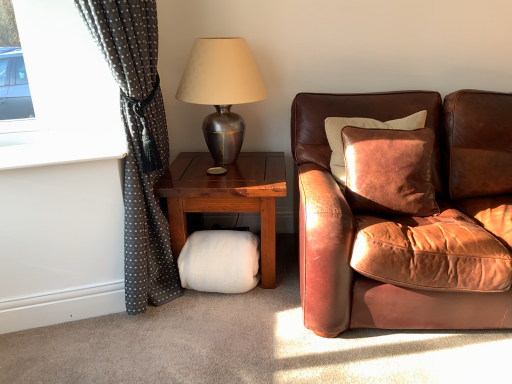
Image resolution: width=512 pixels, height=384 pixels. What do you see at coordinates (138, 144) in the screenshot?
I see `dark grey polka dot fabric at left` at bounding box center [138, 144].

Locate an element on the screen. The width and height of the screenshot is (512, 384). brown leather couch at right is located at coordinates (409, 220).

Locate an element on the screen. This screenshot has width=512, height=384. leather cushion at right is located at coordinates (389, 171).

Where is `white fluffy footrest at lower center`? Image resolution: width=512 pixels, height=384 pixels. white fluffy footrest at lower center is located at coordinates (220, 261).

Is white fluffy pillow at lower center in front of metallic silver lamp at upper center?

No, it is behind metallic silver lamp at upper center.

Consider the image. What's the angular difference between white fluffy pillow at lower center and metallic silver lamp at upper center's facing directions?

There is a 0.00063-degree angle between the facing directions of white fluffy pillow at lower center and metallic silver lamp at upper center.

From the image's perspective, which is below, white fluffy pillow at lower center or metallic silver lamp at upper center?

white fluffy pillow at lower center is shown below in the image.

Is metallic silver lamp at upper center with white fluffy pillow at lower center?

No, metallic silver lamp at upper center is not beside white fluffy pillow at lower center.

Which object is positioned more to the right, metallic silver lamp at upper center or white fluffy pillow at lower center?

white fluffy pillow at lower center.

Considering the positions of objects metallic silver lamp at upper center and white fluffy pillow at lower center in the image provided, who is in front, metallic silver lamp at upper center or white fluffy pillow at lower center?

Positioned in front is metallic silver lamp at upper center.

Which object is closer to the camera taking this photo, white fluffy pillow at lower center or white fluffy footrest at lower center?

white fluffy pillow at lower center is more forward.

Could you tell me if white fluffy pillow at lower center is turned towards white fluffy footrest at lower center?

Yes, white fluffy pillow at lower center is facing white fluffy footrest at lower center.

Is point (265, 186) closer to viewer compared to point (244, 282)?

Yes, it is.

Does white fluffy pillow at lower center have a larger size compared to white fluffy footrest at lower center?

Yes, white fluffy pillow at lower center is bigger than white fluffy footrest at lower center.

From the image's perspective, between leather cushion at right and white fluffy pillow at lower center, who is located below?

white fluffy pillow at lower center appears lower in the image.

Looking at their sizes, would you say leather cushion at right is wider or thinner than white fluffy pillow at lower center?

Clearly, leather cushion at right has less width compared to white fluffy pillow at lower center.

Is leather cushion at right in front of or behind white fluffy pillow at lower center in the image?

leather cushion at right is positioned closer to the viewer than white fluffy pillow at lower center.

Could you tell me if leather cushion at right is turned towards white fluffy pillow at lower center?

No, leather cushion at right is not oriented towards white fluffy pillow at lower center.

Is white fluffy footrest at lower center not inside dark grey polka dot fabric at left?

Yes.

From the image's perspective, which one is positioned lower, white fluffy footrest at lower center or dark grey polka dot fabric at left?

From the image's view, white fluffy footrest at lower center is below.

Looking at their sizes, would you say white fluffy footrest at lower center is wider or thinner than dark grey polka dot fabric at left?

Clearly, white fluffy footrest at lower center has less width compared to dark grey polka dot fabric at left.

Looking at this image, who is more distant, dark grey polka dot fabric at left or leather cushion at right?

leather cushion at right.

Is point (149, 138) closer or farther from the camera than point (395, 182)?

Clearly, point (149, 138) is more distant from the camera than point (395, 182).

From the image's perspective, is dark grey polka dot fabric at left above leather cushion at right?

Yes.

From a real-world perspective, who is located lower, dark grey polka dot fabric at left or leather cushion at right?

leather cushion at right.

Which object is positioned more to the right, white fluffy footrest at lower center or metallic silver lamp at upper center?

From the viewer's perspective, metallic silver lamp at upper center appears more on the right side.

Is white fluffy footrest at lower center in contact with metallic silver lamp at upper center?

white fluffy footrest at lower center is not next to metallic silver lamp at upper center, and they're not touching.

From a real-world perspective, which is physically below, white fluffy footrest at lower center or metallic silver lamp at upper center?

white fluffy footrest at lower center is physically lower.

How many degrees apart are the facing directions of white fluffy footrest at lower center and metallic silver lamp at upper center?

The facing directions of white fluffy footrest at lower center and metallic silver lamp at upper center are 0.672 degrees apart.

In the image, there is a metallic silver lamp at upper center. Identify the location of studio couch below it (from a real-world perspective). (226, 196).

I want to click on studio couch lying on the right of metallic silver lamp at upper center, so click(x=226, y=196).

When comparing their distances from white fluffy footrest at lower center, does metallic silver lamp at upper center or leather cushion at right seem closer?

Among the two, metallic silver lamp at upper center is located nearer to white fluffy footrest at lower center.

When comparing their distances from metallic silver lamp at upper center, does white fluffy pillow at lower center or brown leather couch at right seem closer?

white fluffy pillow at lower center is closer to metallic silver lamp at upper center.

Based on their spatial positions, is dark grey polka dot fabric at left or leather cushion at right closer to metallic silver lamp at upper center?

dark grey polka dot fabric at left lies closer to metallic silver lamp at upper center than the other object.

Which object lies nearer to the anchor point metallic silver lamp at upper center, leather cushion at right or white fluffy footrest at lower center?

Among the two, white fluffy footrest at lower center is located nearer to metallic silver lamp at upper center.

Which object lies nearer to the anchor point metallic silver lamp at upper center, dark grey polka dot fabric at left or white fluffy footrest at lower center?

Based on the image, dark grey polka dot fabric at left appears to be nearer to metallic silver lamp at upper center.

When comparing their distances from brown leather couch at right, does metallic silver lamp at upper center or leather cushion at right seem further?

metallic silver lamp at upper center is positioned further to the anchor brown leather couch at right.

Which object lies nearer to the anchor point brown leather couch at right, dark grey polka dot fabric at left or white fluffy footrest at lower center?

white fluffy footrest at lower center lies closer to brown leather couch at right than the other object.

Estimate the real-world distances between objects in this image. Which object is closer to dark grey polka dot fabric at left, brown leather couch at right or metallic silver lamp at upper center?

metallic silver lamp at upper center is positioned closer to the anchor dark grey polka dot fabric at left.

This screenshot has width=512, height=384. In order to click on lamp located between dark grey polka dot fabric at left and brown leather couch at right in the left-right direction in this screenshot , I will do `click(221, 91)`.

I want to click on studio couch situated between white fluffy footrest at lower center and brown leather couch at right from left to right, so click(226, 196).

Identify the location of studio couch between dark grey polka dot fabric at left and brown leather couch at right. (226, 196).

In order to click on pillow situated between white fluffy footrest at lower center and brown leather couch at right from left to right in this screenshot , I will do `click(389, 171)`.